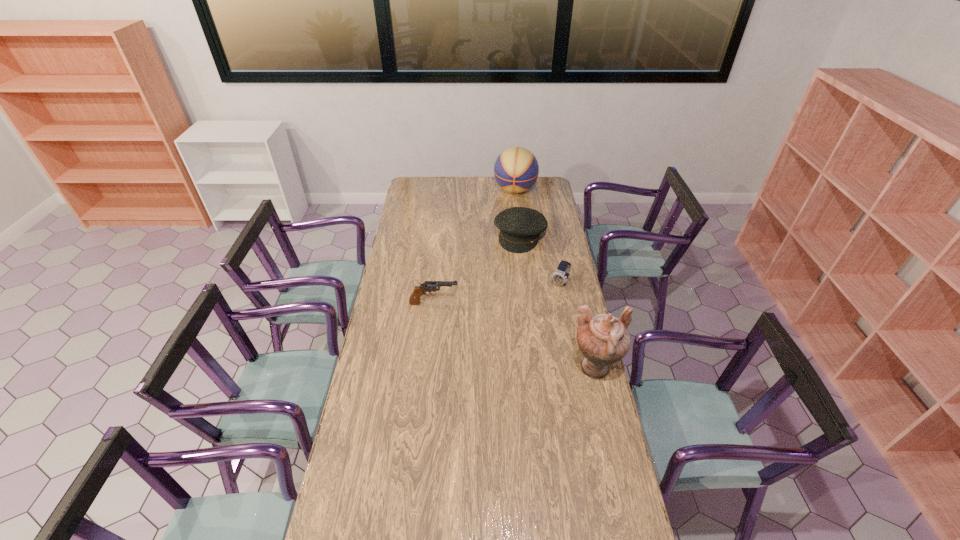
The height and width of the screenshot is (540, 960). In order to click on the leftmost object in this screenshot , I will do `click(428, 286)`.

Identify the location of the second nearest object. This screenshot has height=540, width=960. (428, 286).

Find the location of a particular element. This screenshot has height=540, width=960. urn is located at coordinates (604, 339).

The height and width of the screenshot is (540, 960). In order to click on beret in this screenshot , I will do `click(520, 227)`.

Identify the location of the third farthest object. This screenshot has width=960, height=540. (560, 277).

Locate an element on the screen. basketball is located at coordinates (516, 169).

Locate an element on the screen. The image size is (960, 540). vacant area situated along the barrel of the second nearest object is located at coordinates pos(523,303).

You are a GUI agent. You are given a task and a screenshot of the screen. Output one action in this format:
    pyautogui.click(x=<x>, y=<y>)
    Task: Click on the vacant space located on the left of the urn
    
    Given the screenshot: What is the action you would take?
    pyautogui.click(x=515, y=369)

Identify the location of vacant region located 0.360m on the front-facing side of the beret. 497,299.

Where is `vacant space positioned 0.230m on the front-facing side of the beret`? vacant space positioned 0.230m on the front-facing side of the beret is located at coordinates pos(504,281).